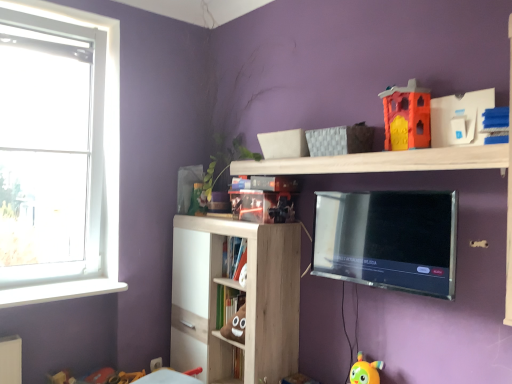
Question: Which direction should I rotate to face glossy plastic bookshelf at upper center, the third book in the bottom-to-top sequence, — up or down?

Choices:
 (A) up
 (B) down

Answer: (B)

Question: From the image's perspective, does orange matte plastic castle at upper right, the second toy from the bottom, appear lower than white matte bookshelf at center, which ranks as the 3th book in top-to-bottom order?

Choices:
 (A) no
 (B) yes

Answer: (A)

Question: Considering the relative sizes of orange matte plastic castle at upper right, the 1th toy positioned from the top, and white matte bookshelf at center, which ranks as the 1th book in bottom-to-top order, in the image provided, is orange matte plastic castle at upper right, the 1th toy positioned from the top, wider than white matte bookshelf at center, which ranks as the 1th book in bottom-to-top order,?

Choices:
 (A) yes
 (B) no

Answer: (B)

Question: Are orange matte plastic castle at upper right, the 1th toy positioned from the top, and white matte bookshelf at center, which ranks as the 3th book in top-to-bottom order, located far from each other?

Choices:
 (A) no
 (B) yes

Answer: (B)

Question: Does orange matte plastic castle at upper right, the second toy from the bottom, have a larger size compared to white matte bookshelf at center, which ranks as the 1th book in bottom-to-top order?

Choices:
 (A) yes
 (B) no

Answer: (B)

Question: Is the depth of orange matte plastic castle at upper right, the second toy from the bottom, greater than that of white matte bookshelf at center, which ranks as the 3th book in top-to-bottom order?

Choices:
 (A) no
 (B) yes

Answer: (A)

Question: Considering the relative sizes of orange matte plastic castle at upper right, the second toy from the bottom, and white matte bookshelf at center, which ranks as the 1th book in bottom-to-top order, in the image provided, is orange matte plastic castle at upper right, the second toy from the bottom, thinner than white matte bookshelf at center, which ranks as the 1th book in bottom-to-top order,?

Choices:
 (A) no
 (B) yes

Answer: (B)

Question: Is satin black tv at upper center shorter than white matte bookshelf at center, which ranks as the 3th book in top-to-bottom order?

Choices:
 (A) no
 (B) yes

Answer: (A)

Question: Considering the relative positions of satin black tv at upper center and white matte bookshelf at center, which ranks as the 3th book in top-to-bottom order, in the image provided, is satin black tv at upper center to the right of white matte bookshelf at center, which ranks as the 3th book in top-to-bottom order, from the viewer's perspective?

Choices:
 (A) no
 (B) yes

Answer: (B)

Question: From a real-world perspective, is satin black tv at upper center on white matte bookshelf at center, which ranks as the 3th book in top-to-bottom order?

Choices:
 (A) yes
 (B) no

Answer: (A)

Question: Is satin black tv at upper center positioned far away from white matte bookshelf at center, which ranks as the 3th book in top-to-bottom order?

Choices:
 (A) no
 (B) yes

Answer: (A)

Question: Can you confirm if satin black tv at upper center is positioned to the left of white matte bookshelf at center, which ranks as the 1th book in bottom-to-top order?

Choices:
 (A) no
 (B) yes

Answer: (A)

Question: From a real-world perspective, does satin black tv at upper center sit lower than white matte bookshelf at center, which ranks as the 3th book in top-to-bottom order?

Choices:
 (A) no
 (B) yes

Answer: (A)

Question: From the image's perspective, does glossy plastic bookshelf at upper center, which is the first book in top-to-bottom order, appear higher than white plastic window at left?

Choices:
 (A) yes
 (B) no

Answer: (B)